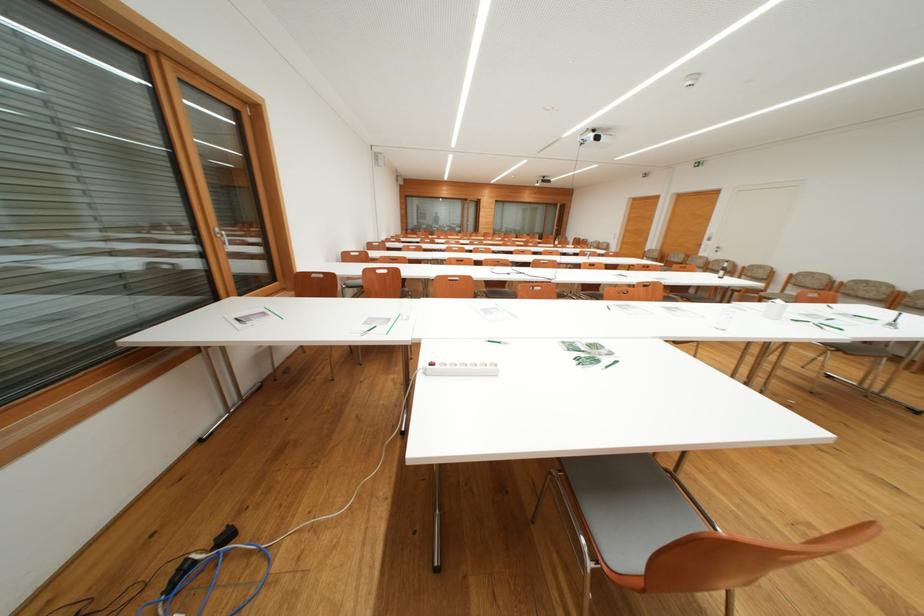
Find where to sit the grey chair sitting surface. Please return your answer as a coordinate pair (x, y).

(634, 508)